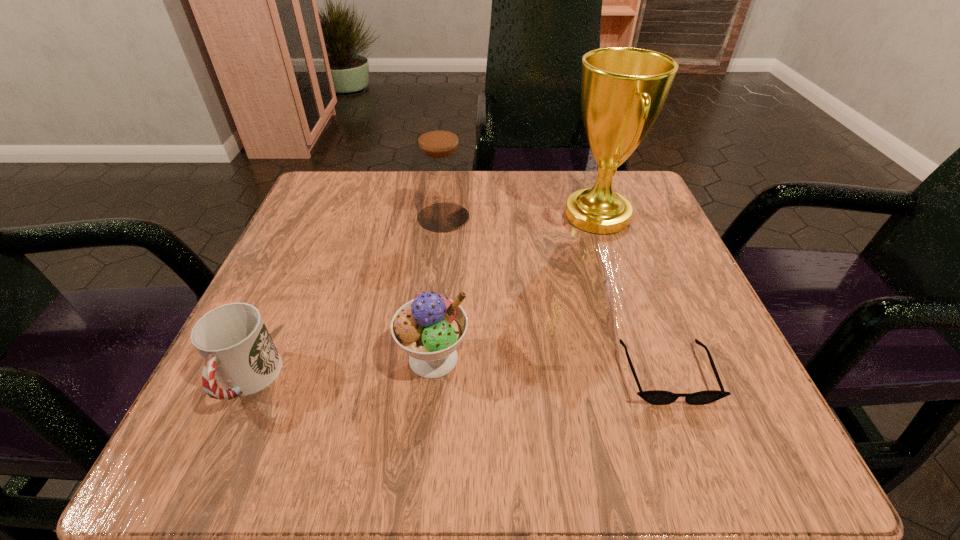
Image resolution: width=960 pixels, height=540 pixels. In order to click on free space that satisfies the following two spatial constraints: 1. by the handles of the tallest object; 2. on the handle side of the cup in this screenshot , I will do 653,381.

What are the coordinates of `free space that satisfies the following two spatial constraints: 1. by the handles of the award; 2. on the handle side of the cup` in the screenshot? It's located at (653, 381).